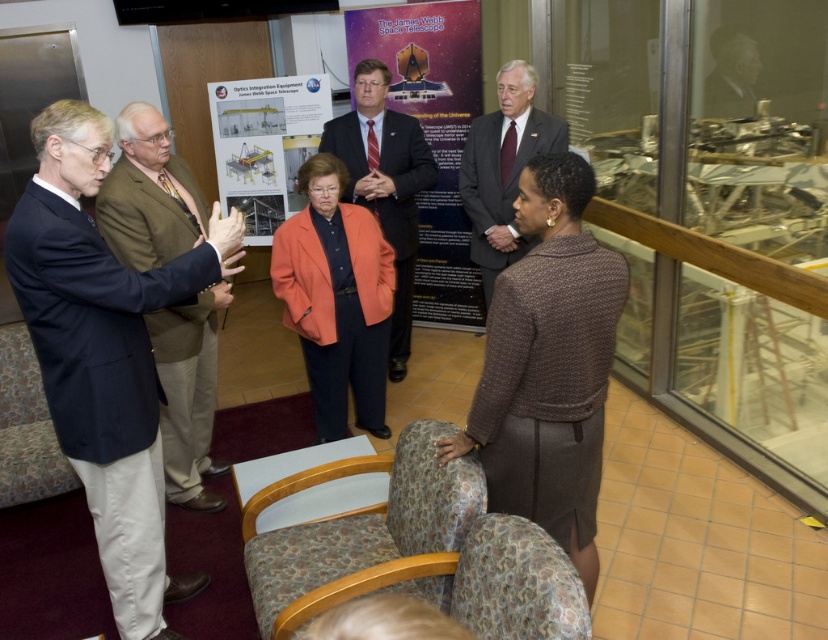
Looking at this image, where is the matte black suit at center located in the image?

The matte black suit at center is located at point coordinates of approximately (384, 184).

You are an event planner setting up a presentation space. You need to ensure that the matte black poster at center and the matte black suit at center are positioned so that there is at least 60 centimeters of space between them for attendees to comfortably pass through. Based on the scene description, is the current distance sufficient?

The distance between the matte black poster at center and the matte black suit at center is 62.03 centimeters, which is more than the required 60 centimeters. Therefore, the current spacing allows for comfortable passage for attendees.